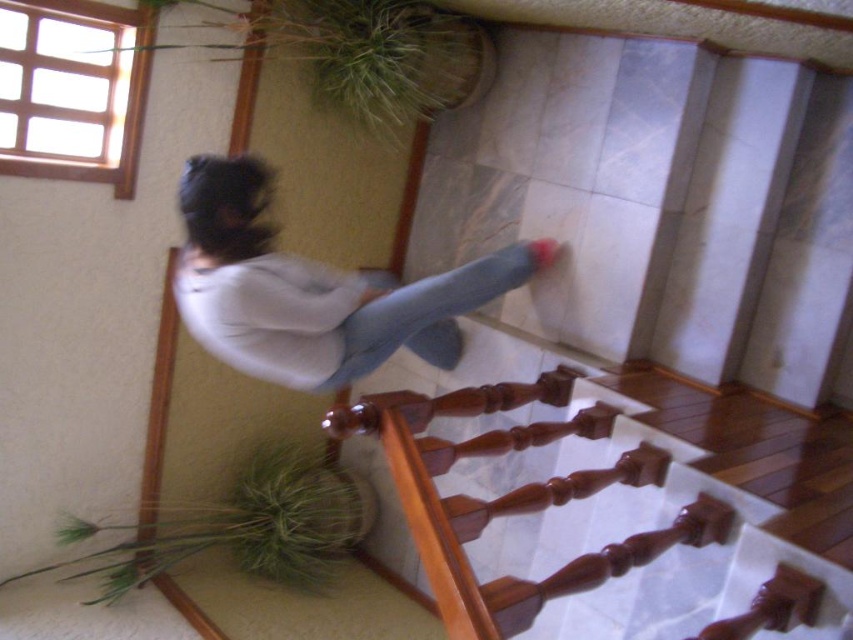
You are standing at the entrance of the building and want to reach the wooden staircase at center. Which direction should you walk to get there?

The wooden staircase at center is located at coordinates (624, 509), so you should walk towards the center of the image to reach it.

Based on the photo, you are standing at the bottom of the wooden staircase at center and want to reach the light blue denim jeans at center. In which direction should you move to get closer to the jeans?

The wooden staircase at center is to the right of light blue denim jeans at center, so you should move to the left to get closer to the jeans.

You are standing at the bottom of the wooden staircase at center and want to reach the light blue denim jeans at center. Which direction should you move to get closer to the jeans?

Since the wooden staircase at center is closer to the viewer than the light blue denim jeans at center, you should move forward away from the staircase towards the jeans to get closer to them.